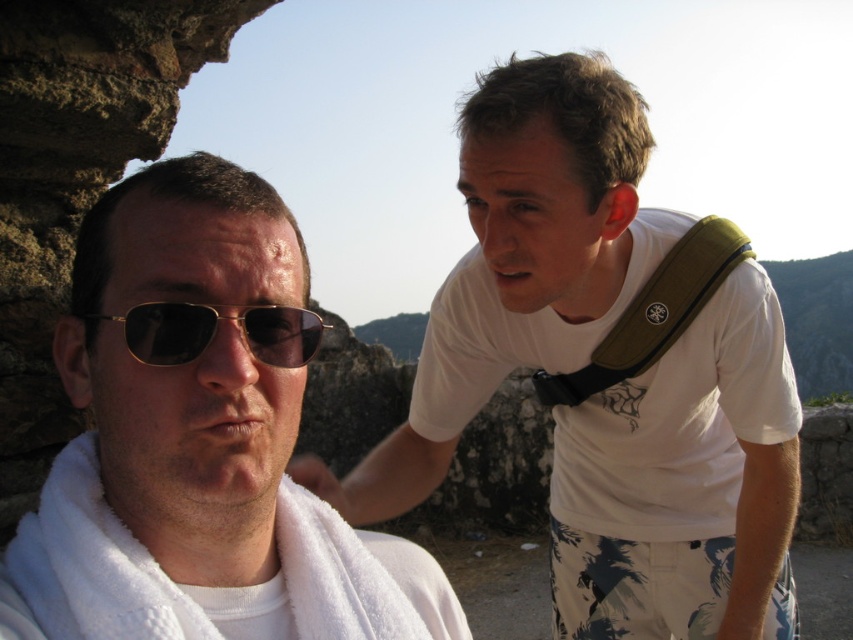
Question: Estimate the real-world distances between objects in this image. Which object is closer to the white towel at left?

Choices:
 (A) gold metallic sunglasses at left
 (B) green fabric strap at upper right

Answer: (A)

Question: Is white cotton shirt at upper right to the left of white towel at left from the viewer's perspective?

Choices:
 (A) no
 (B) yes

Answer: (A)

Question: Can you confirm if white towel at left is bigger than gold metallic sunglasses at left?

Choices:
 (A) yes
 (B) no

Answer: (A)

Question: Which of the following is the farthest from the observer?

Choices:
 (A) (250, 577)
 (B) (709, 557)
 (C) (300, 308)

Answer: (B)

Question: Does green fabric strap at upper right appear under gold metallic sunglasses at left?

Choices:
 (A) yes
 (B) no

Answer: (B)

Question: Estimate the real-world distances between objects in this image. Which object is farther from the white cotton shirt at upper right?

Choices:
 (A) green fabric strap at upper right
 (B) white towel at left
 (C) gold metallic sunglasses at left

Answer: (C)